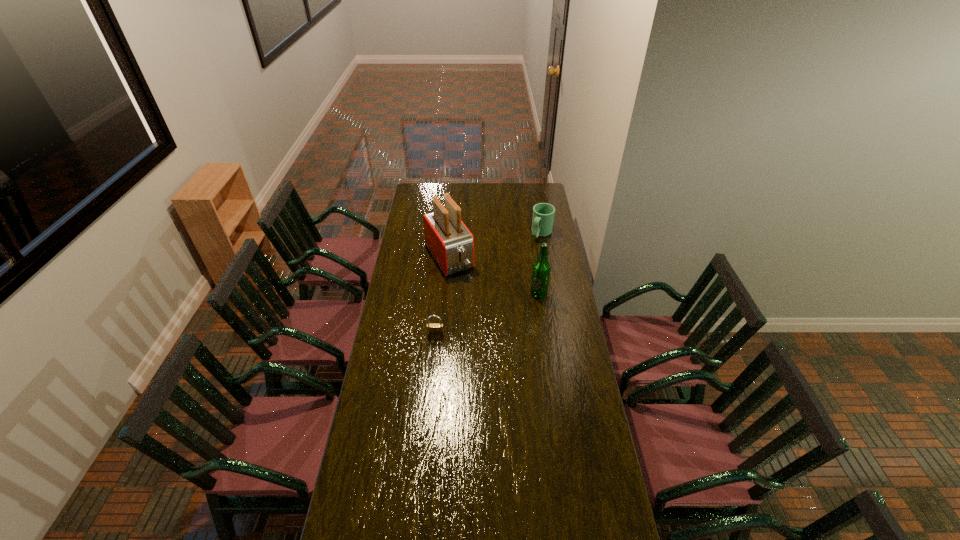
Where is `object that stands as the third closest to the toaster`? This screenshot has height=540, width=960. object that stands as the third closest to the toaster is located at coordinates (434, 329).